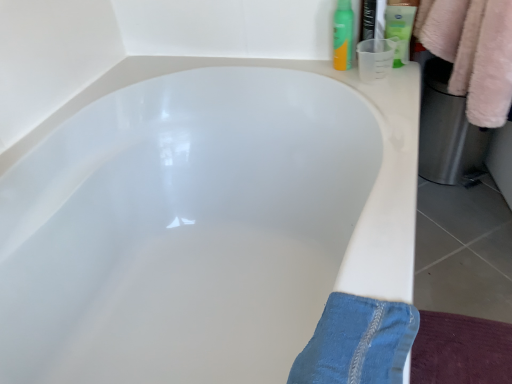
Question: Is green matte spray can at upper right, marked as the second toiletry in a right-to-left arrangement, at the back of denim at lower right?

Choices:
 (A) no
 (B) yes

Answer: (A)

Question: From the image's perspective, does denim at lower right appear higher than green matte spray can at upper right, marked as the first toiletry in a left-to-right arrangement?

Choices:
 (A) no
 (B) yes

Answer: (A)

Question: Can you confirm if denim at lower right is shorter than green matte spray can at upper right, marked as the first toiletry in a left-to-right arrangement?

Choices:
 (A) no
 (B) yes

Answer: (B)

Question: Can you confirm if denim at lower right is bigger than green matte spray can at upper right, marked as the first toiletry in a left-to-right arrangement?

Choices:
 (A) no
 (B) yes

Answer: (B)

Question: Is denim at lower right directly adjacent to green matte spray can at upper right, marked as the second toiletry in a right-to-left arrangement?

Choices:
 (A) no
 (B) yes

Answer: (A)

Question: From the image's perspective, does denim at lower right appear lower than green matte spray can at upper right, marked as the first toiletry in a left-to-right arrangement?

Choices:
 (A) no
 (B) yes

Answer: (B)

Question: Could you tell me if white glossy bathtub at center is turned towards denim at lower right?

Choices:
 (A) yes
 (B) no

Answer: (B)

Question: From a real-world perspective, is white glossy bathtub at center over denim at lower right?

Choices:
 (A) yes
 (B) no

Answer: (B)

Question: Can you confirm if white glossy bathtub at center is taller than denim at lower right?

Choices:
 (A) no
 (B) yes

Answer: (B)

Question: Is white glossy bathtub at center surrounding denim at lower right?

Choices:
 (A) no
 (B) yes

Answer: (B)

Question: Are white glossy bathtub at center and denim at lower right located far from each other?

Choices:
 (A) yes
 (B) no

Answer: (B)

Question: From a real-world perspective, is white glossy bathtub at center located beneath denim at lower right?

Choices:
 (A) yes
 (B) no

Answer: (A)

Question: Is denim at lower right smaller than green matte lotion at upper right, acting as the second toiletry starting from the left?

Choices:
 (A) yes
 (B) no

Answer: (B)